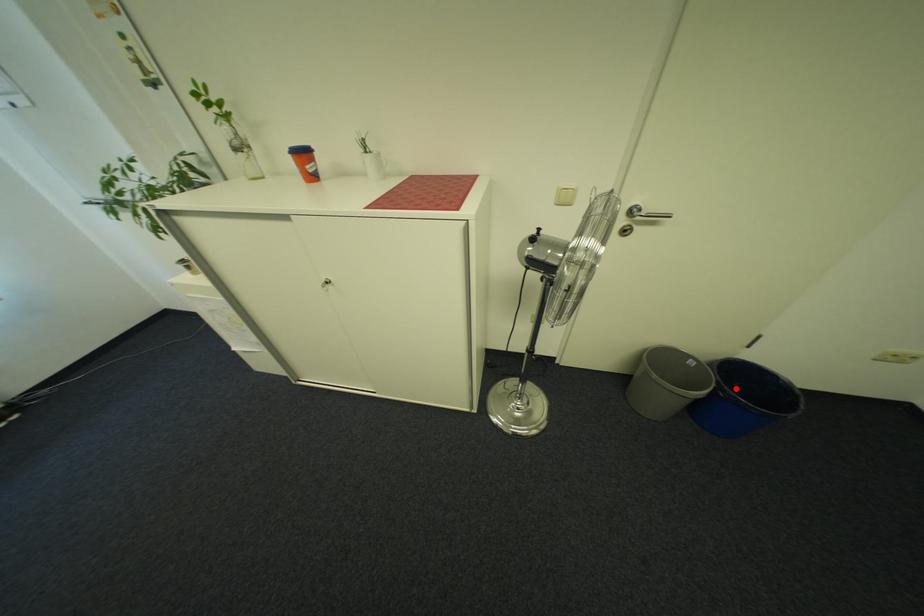
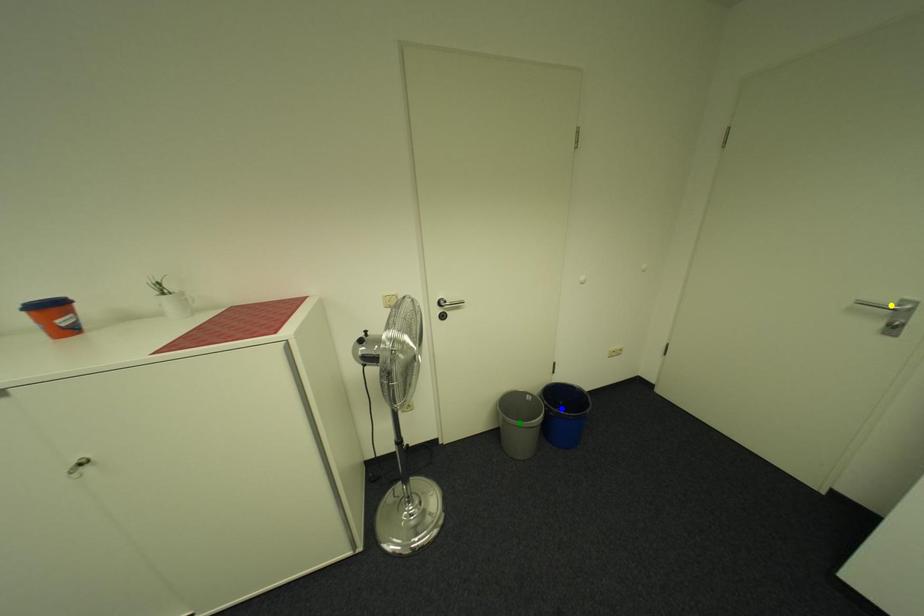
Question: I am providing you with two images of the same scene from different viewpoints. A red point is marked on the first image. You are given multiple points on the second image. Can you choose the point in image 2 that corresponds to the point in image 1?

Choices:
 (A) blue point
 (B) yellow point
 (C) green point

Answer: (A)